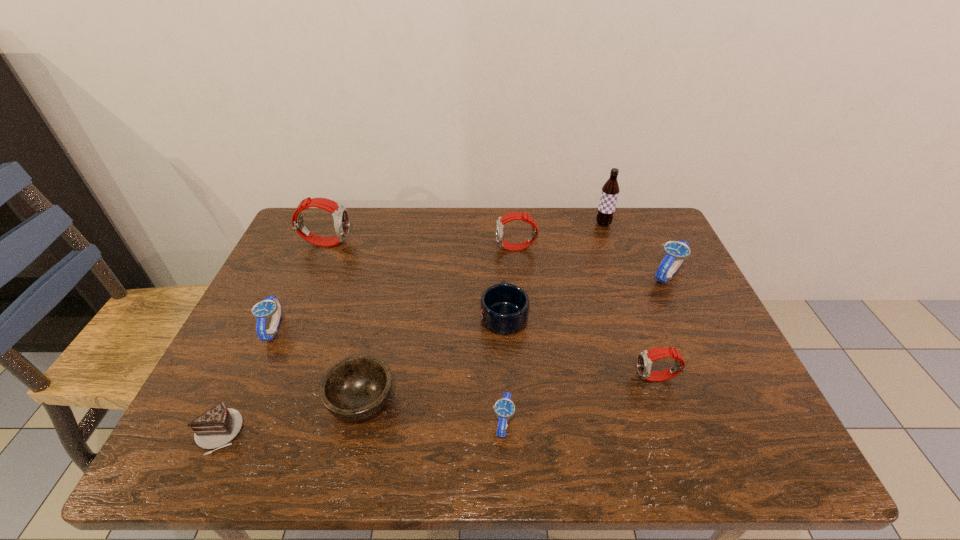
At what (x,y) coordinates should I click in order to perform the action: click on object situated at the far left corner. Please return your answer as a coordinate pair (x, y). This screenshot has height=540, width=960. Looking at the image, I should click on (340, 215).

Identify the location of object situated at the near left corner. (216, 427).

The width and height of the screenshot is (960, 540). I want to click on object situated at the far right corner, so pos(610,190).

In the image, there is a desktop. What are the coordinates of `vacant region at the far edge` in the screenshot? It's located at (592, 225).

I want to click on free space at the near edge of the desktop, so click(x=509, y=448).

Locate an element on the screen. This screenshot has height=540, width=960. vacant space at the left edge of the desktop is located at coordinates (277, 404).

The image size is (960, 540). What are the coordinates of `vacant space at the right edge` in the screenshot? It's located at (727, 397).

In order to click on free location at the near left corner in this screenshot , I will do `click(205, 452)`.

At what (x,y) coordinates should I click in order to perform the action: click on free space at the far right corner of the desktop. Please return your answer as a coordinate pair (x, y). The height and width of the screenshot is (540, 960). Looking at the image, I should click on (641, 223).

The height and width of the screenshot is (540, 960). Find the location of `vacant space in between the fourth object from left to right and the blue mug`. vacant space in between the fourth object from left to right and the blue mug is located at coordinates (433, 358).